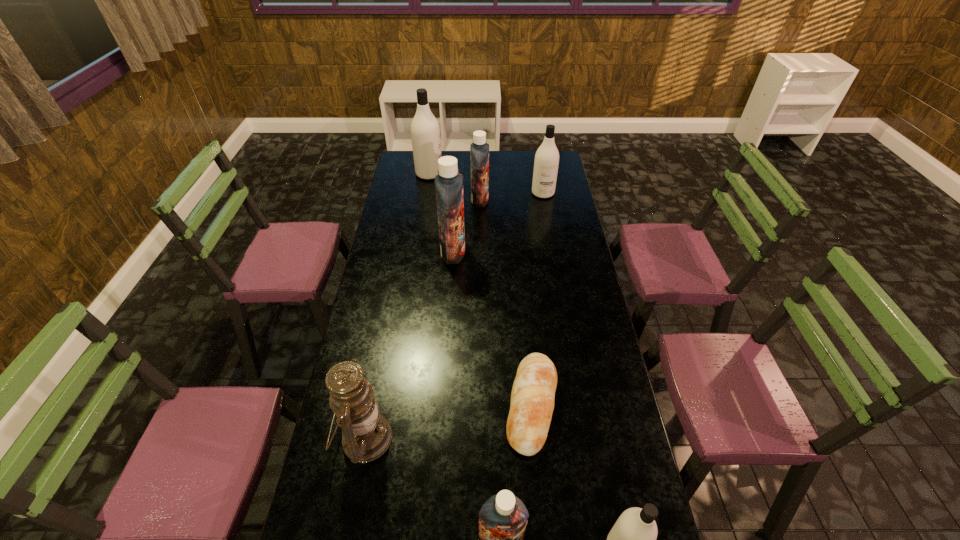
Image resolution: width=960 pixels, height=540 pixels. I want to click on vacant area situated 0.150m on the front label of the second nearest blue shampoo, so click(500, 252).

Image resolution: width=960 pixels, height=540 pixels. I want to click on vacant area situated 0.250m on the front label of the second smallest blue shampoo, so click(539, 200).

You are a GUI agent. You are given a task and a screenshot of the screen. Output one action in this format:
    pyautogui.click(x=<x>, y=<y>)
    Task: Click on the vacant space situated 0.400m on the front-facing side of the second nearest white shampoo
    The width and height of the screenshot is (960, 540).
    Given the screenshot: What is the action you would take?
    pyautogui.click(x=554, y=253)

Where is `vacant point located 0.390m on the right of the oil lamp`? The height and width of the screenshot is (540, 960). vacant point located 0.390m on the right of the oil lamp is located at coordinates (521, 438).

The image size is (960, 540). I want to click on free spot located 0.110m on the left of the shortest object, so click(x=470, y=406).

At what (x,y) coordinates should I click in order to perform the action: click on object at the far edge. Please return your answer as a coordinate pair (x, y). The image size is (960, 540). Looking at the image, I should click on (425, 132).

I want to click on shampoo that is at the left edge, so click(425, 132).

Identify the location of oil lamp that is at the left edge. This screenshot has width=960, height=540. (366, 435).

At what (x,y) coordinates should I click in order to perform the action: click on object that is at the right edge. Please return your answer as a coordinate pair (x, y). The image size is (960, 540). Looking at the image, I should click on (546, 162).

At what (x,y) coordinates should I click in order to perform the action: click on object at the far left corner. Please return your answer as a coordinate pair (x, y). The height and width of the screenshot is (540, 960). Looking at the image, I should click on (425, 132).